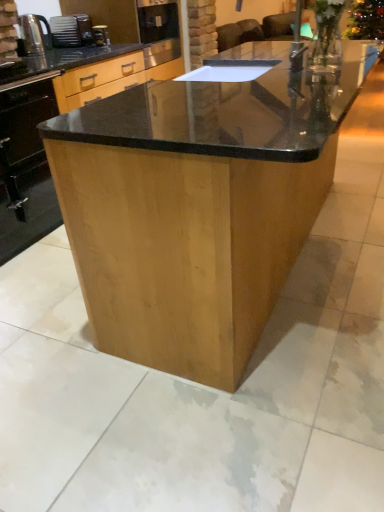
Question: Does metallic silver kettle at left have a greater width compared to black glossy oven at lower left?

Choices:
 (A) no
 (B) yes

Answer: (A)

Question: Is metallic silver kettle at left outside black glossy oven at lower left?

Choices:
 (A) no
 (B) yes

Answer: (B)

Question: Considering the relative sizes of metallic silver kettle at left and black glossy oven at lower left in the image provided, is metallic silver kettle at left taller than black glossy oven at lower left?

Choices:
 (A) no
 (B) yes

Answer: (A)

Question: Is metallic silver kettle at left with black glossy oven at lower left?

Choices:
 (A) no
 (B) yes

Answer: (A)

Question: Is metallic silver kettle at left smaller than black glossy oven at lower left?

Choices:
 (A) yes
 (B) no

Answer: (A)

Question: Is satin black toaster at upper left in front of or behind black glossy oven at lower left in the image?

Choices:
 (A) behind
 (B) front

Answer: (A)

Question: In terms of size, does satin black toaster at upper left appear bigger or smaller than black glossy oven at lower left?

Choices:
 (A) big
 (B) small

Answer: (B)

Question: Is satin black toaster at upper left to the left or to the right of black glossy oven at lower left in the image?

Choices:
 (A) left
 (B) right

Answer: (B)

Question: Considering the positions of point (81, 23) and point (3, 244), is point (81, 23) closer or farther from the camera than point (3, 244)?

Choices:
 (A) farther
 (B) closer

Answer: (A)

Question: In terms of width, does shiny brown wood table at center look wider or thinner when compared to satin black toaster at upper left?

Choices:
 (A) wide
 (B) thin

Answer: (A)

Question: In terms of size, does shiny brown wood table at center appear bigger or smaller than satin black toaster at upper left?

Choices:
 (A) big
 (B) small

Answer: (A)

Question: From a real-world perspective, relative to satin black toaster at upper left, is shiny brown wood table at center vertically above or below?

Choices:
 (A) below
 (B) above

Answer: (A)

Question: Relative to satin black toaster at upper left, is shiny brown wood table at center in front or behind?

Choices:
 (A) behind
 (B) front

Answer: (B)

Question: Considering the positions of shiny brown wood table at center and metallic silver kettle at left in the image, is shiny brown wood table at center bigger or smaller than metallic silver kettle at left?

Choices:
 (A) big
 (B) small

Answer: (A)

Question: Considering the positions of shiny brown wood table at center and metallic silver kettle at left in the image, is shiny brown wood table at center wider or thinner than metallic silver kettle at left?

Choices:
 (A) thin
 (B) wide

Answer: (B)